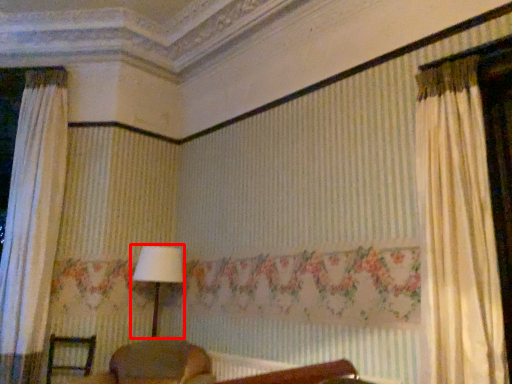
Question: From the image's perspective, what is the correct spatial positioning of table lamp (annotated by the red box) in reference to furniture?

Choices:
 (A) below
 (B) above

Answer: (B)